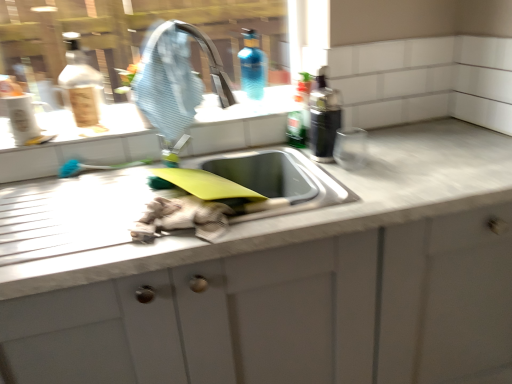
Locate an element on the screen. This screenshot has height=384, width=512. vacant area that is situated to the right of black plastic bottle at upper right, marked as the 3th bottle in a left-to-right arrangement is located at coordinates (369, 151).